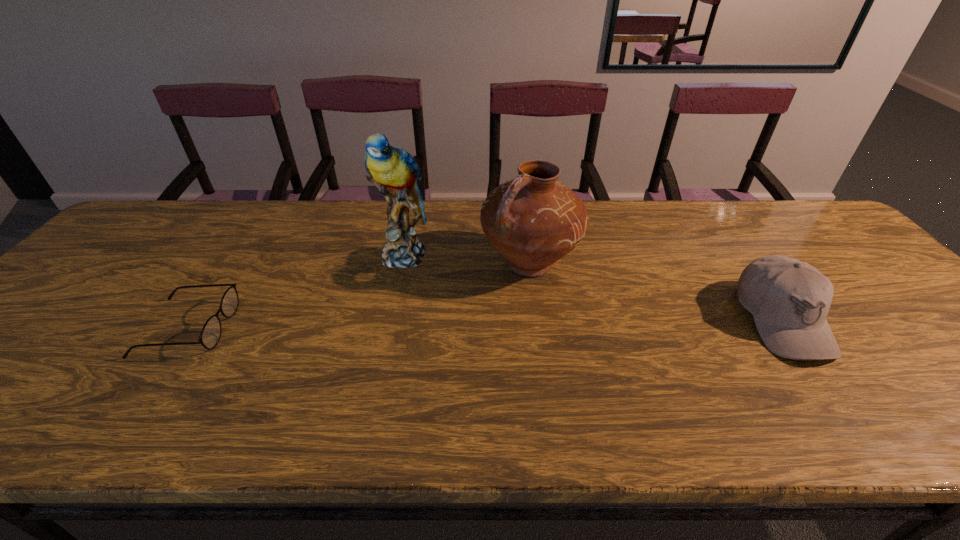
You are a GUI agent. You are given a task and a screenshot of the screen. Output one action in this format:
    pyautogui.click(x=<x>, y=<y>)
    Task: Click on the free space on the desktop that is between the leftmost object and the rightmost object and is positioned on the side of the second object from right to left with the handle
    The height and width of the screenshot is (540, 960).
    Given the screenshot: What is the action you would take?
    pyautogui.click(x=427, y=325)

Where is `vacant space on the desktop that is between the spectacles and the second shortest object and is positioned on the face of the parrot`? vacant space on the desktop that is between the spectacles and the second shortest object and is positioned on the face of the parrot is located at coordinates (404, 325).